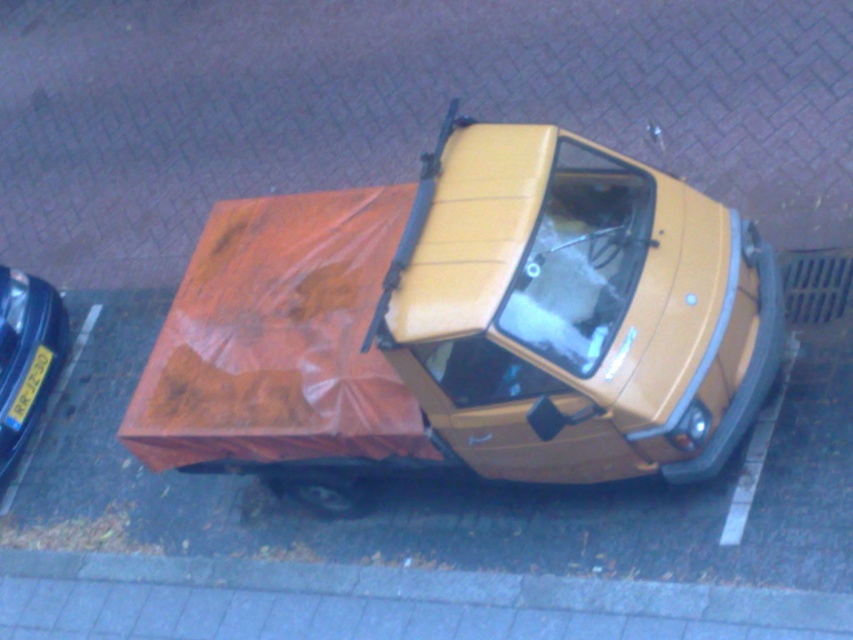
Is shiny blue car at left to the right of yellow plastic license plate at lower left from the viewer's perspective?

Incorrect, shiny blue car at left is not on the right side of yellow plastic license plate at lower left.

Can you confirm if shiny blue car at left is bigger than yellow plastic license plate at lower left?

Correct, shiny blue car at left is larger in size than yellow plastic license plate at lower left.

The height and width of the screenshot is (640, 853). Identify the location of shiny blue car at left. (26, 358).

Where is `shiny blue car at left`? This screenshot has height=640, width=853. shiny blue car at left is located at coordinates (26, 358).

Can you confirm if matte yellow car at center is taller than shiny blue car at left?

Indeed, matte yellow car at center has a greater height compared to shiny blue car at left.

Does matte yellow car at center appear on the right side of shiny blue car at left?

Indeed, matte yellow car at center is positioned on the right side of shiny blue car at left.

Between point (599, 348) and point (49, 371), which one is positioned behind?

The point (49, 371) is more distant.

You are a GUI agent. You are given a task and a screenshot of the screen. Output one action in this format:
    pyautogui.click(x=<x>, y=<y>)
    Task: Click on the matte yellow car at center
    Image resolution: width=853 pixels, height=640 pixels.
    Given the screenshot: What is the action you would take?
    pyautogui.click(x=467, y=324)

Can you confirm if matte yellow car at center is smaller than yellow plastic license plate at lower left?

Incorrect, matte yellow car at center is not smaller in size than yellow plastic license plate at lower left.

Can you confirm if matte yellow car at center is taller than yellow plastic license plate at lower left?

Yes, matte yellow car at center is taller than yellow plastic license plate at lower left.

In the scene shown: Who is more forward, (x=164, y=360) or (x=19, y=410)?

Positioned in front is point (x=164, y=360).

The image size is (853, 640). Identify the location of matte yellow car at center. (467, 324).